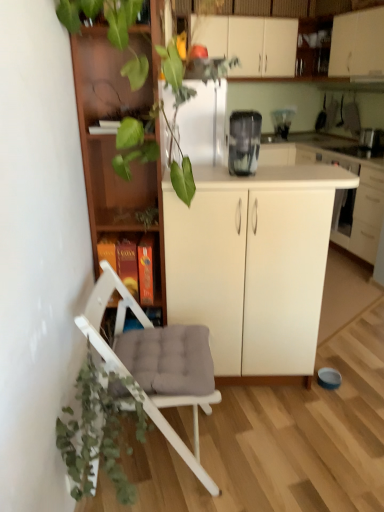
Question: Which direction should I rotate to look at white matte cabinet at center, the 3th cabinetry when ordered from right to left?

Choices:
 (A) left
 (B) right

Answer: (B)

Question: Does white matte cabinet at center, the 1th cabinetry when ordered from right to left, contain green leafy plant at upper center?

Choices:
 (A) no
 (B) yes

Answer: (A)

Question: Can you confirm if white matte cabinet at center, marked as the second cabinetry in a top-to-bottom arrangement, is positioned to the left of green leafy plant at upper center?

Choices:
 (A) no
 (B) yes

Answer: (A)

Question: Is white matte cabinet at center, the 1th cabinetry when ordered from right to left, looking in the opposite direction of green leafy plant at upper center?

Choices:
 (A) no
 (B) yes

Answer: (A)

Question: Is white matte cabinet at center, the 3th cabinetry viewed from the left, to the right of green leafy plant at upper center from the viewer's perspective?

Choices:
 (A) no
 (B) yes

Answer: (B)

Question: Is white matte cabinet at center, the 1th cabinetry when ordered from right to left, completely or partially outside of green leafy plant at upper center?

Choices:
 (A) yes
 (B) no

Answer: (A)

Question: Does white matte cabinet at center, the 1th cabinetry when ordered from right to left, have a greater height compared to green leafy plant at upper center?

Choices:
 (A) no
 (B) yes

Answer: (B)

Question: Does white matte cabinet at upper center have a smaller size compared to white matte cabinet at center, which is the first cabinetry from bottom to top?

Choices:
 (A) yes
 (B) no

Answer: (B)

Question: Would you say white matte cabinet at upper center is outside white matte cabinet at center, which is the first cabinetry from bottom to top?

Choices:
 (A) yes
 (B) no

Answer: (A)

Question: Does white matte cabinet at upper center appear on the left side of white matte cabinet at center, the 3th cabinetry when ordered from right to left?

Choices:
 (A) yes
 (B) no

Answer: (B)

Question: Is white matte cabinet at upper center not close to white matte cabinet at center, which is the first cabinetry from bottom to top?

Choices:
 (A) no
 (B) yes

Answer: (B)

Question: From the image's perspective, is white matte cabinet at upper center beneath white matte cabinet at center, the 3th cabinetry when ordered from right to left?

Choices:
 (A) yes
 (B) no

Answer: (B)

Question: From a real-world perspective, is white matte cabinet at upper center located higher than white matte cabinet at center, which is the first cabinetry from bottom to top?

Choices:
 (A) no
 (B) yes

Answer: (B)

Question: Is white glossy cabinet at upper right, which appears as the 2th cabinetry when viewed from the right, far away from transparent plastic blender at upper center, positioned as the 3th appliance in bottom-to-top order?

Choices:
 (A) no
 (B) yes

Answer: (B)